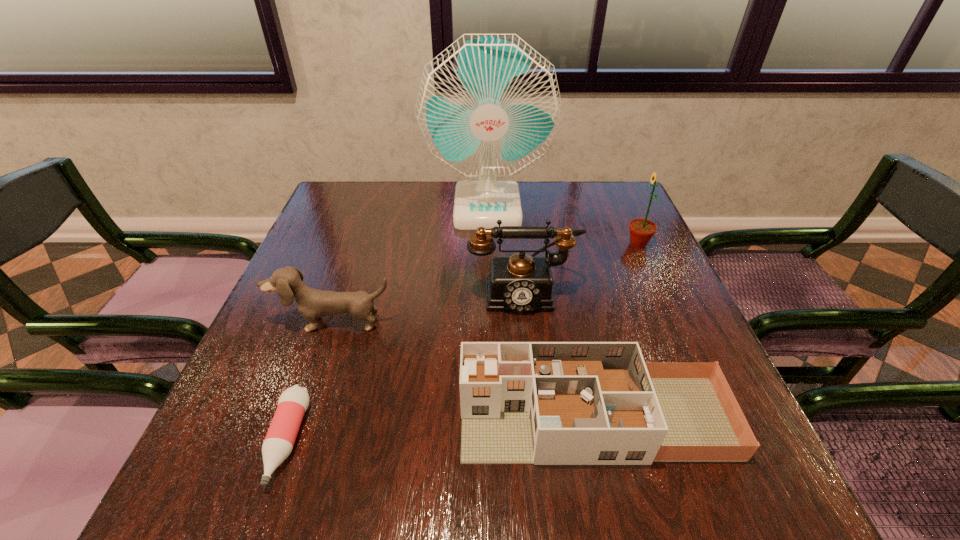
At what (x,y) coordinates should I click in order to perform the action: click on vacant space located 0.380m on the face of the sunflower. Please return your answer as a coordinate pair (x, y). Image resolution: width=960 pixels, height=540 pixels. Looking at the image, I should click on (480, 244).

This screenshot has height=540, width=960. What are the coordinates of `vacant position located on the front of the telephone at the rotary dial` in the screenshot? It's located at (528, 343).

Find the location of a particular element. This screenshot has width=960, height=540. vacant region located 0.050m at the face of the puppy is located at coordinates (324, 354).

Locate an element on the screen. The width and height of the screenshot is (960, 540). free space located at the front door of the fifth tallest object is located at coordinates (296, 418).

This screenshot has height=540, width=960. What are the coordinates of `free space located at the front door of the fifth tallest object` in the screenshot? It's located at (245, 418).

Where is `vacant space located 0.250m at the front door of the fifth tallest object`? vacant space located 0.250m at the front door of the fifth tallest object is located at coordinates (319, 418).

This screenshot has height=540, width=960. I want to click on object present at the far edge, so click(x=488, y=105).

The image size is (960, 540). Identify the location of dollhouse at the near edge. (545, 403).

I want to click on bottle that is at the near edge, so click(279, 441).

Locate an element on the screen. Image resolution: width=960 pixels, height=540 pixels. puppy positioned at the left edge is located at coordinates (312, 304).